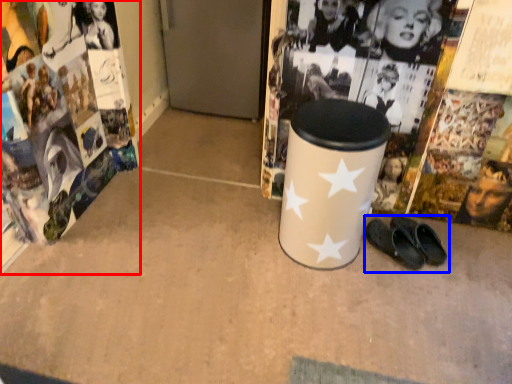
Question: Which point is further to the camera, magazine (highlighted by a red box) or footwear (highlighted by a blue box)?

Choices:
 (A) magazine
 (B) footwear

Answer: (B)